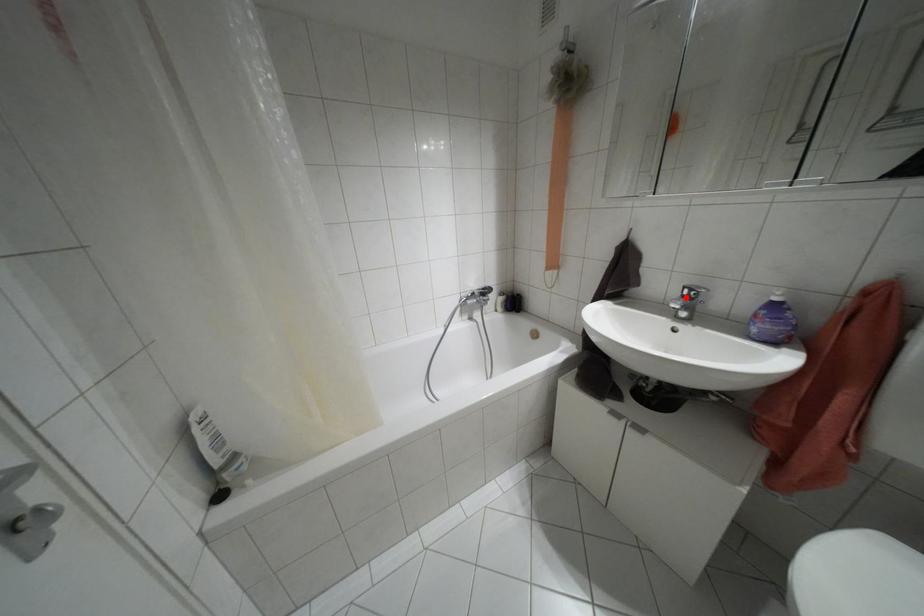
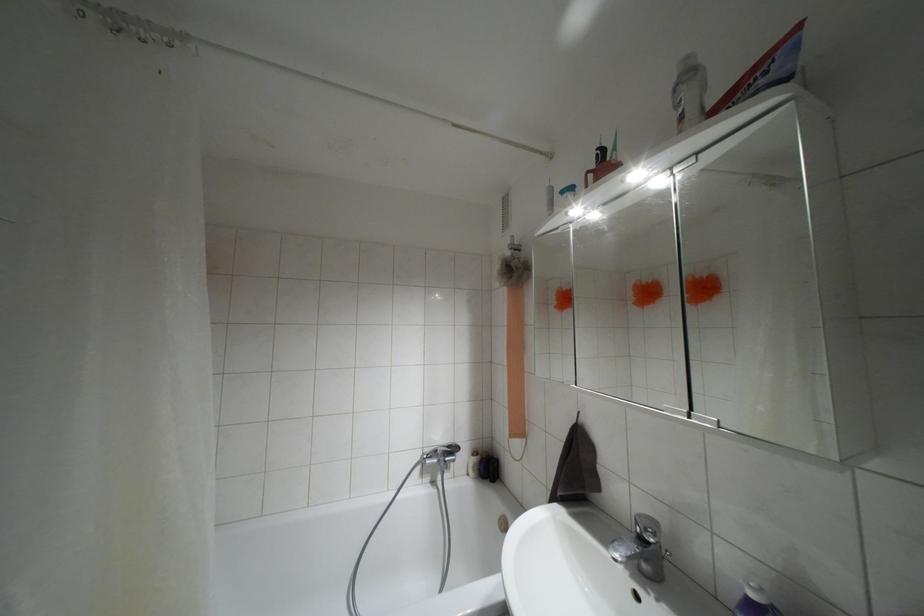
Where in the second image is the point corresponding to the highlighted location from the first image?

(641, 538)